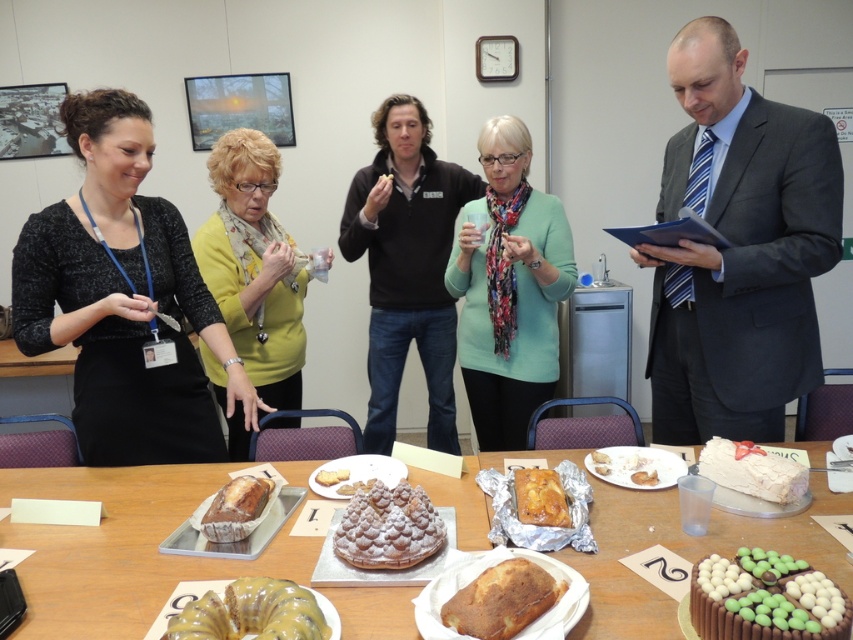
You are planning to take a photo of the glossy yellow cake at center and the chocolate frosted cake with chocolate candies at center. To ensure both are in frame, should you position yourself to the left or right of the table?

You should position yourself to the left of the table to capture both the glossy yellow cake at center and the chocolate frosted cake with chocolate candies at center in the frame, as the chocolate frosted cake with chocolate candies at center is to the right of the glossy yellow cake at center.

You are planning to place a rectangular cake stand that is 24 inches long between the chocolate frosted cake with chocolate candies at center and the glossy yellow cake at center. Will the stand fit without overlapping either cake?

The distance between the chocolate frosted cake with chocolate candies at center and the glossy yellow cake at center is 25.51 inches. Since the cake stand is 24 inches long, there is enough space to place it between them without overlapping either cake.

You are planning to take a photo of the baked golden loaf at center and the white frosted cake at lower right for a food blog. Since you want to highlight their height differences, which object should you position closer to the camera to emphasize its height?

To emphasize the height difference between the white frosted cake at lower right and the baked golden loaf at center, position the white frosted cake at lower right closer to the camera since it is taller than the baked golden loaf at center.